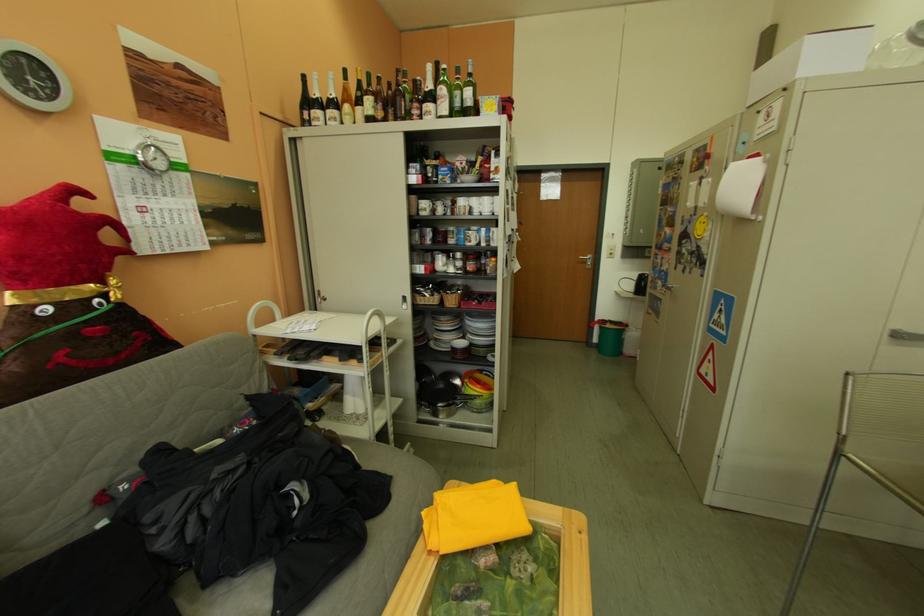
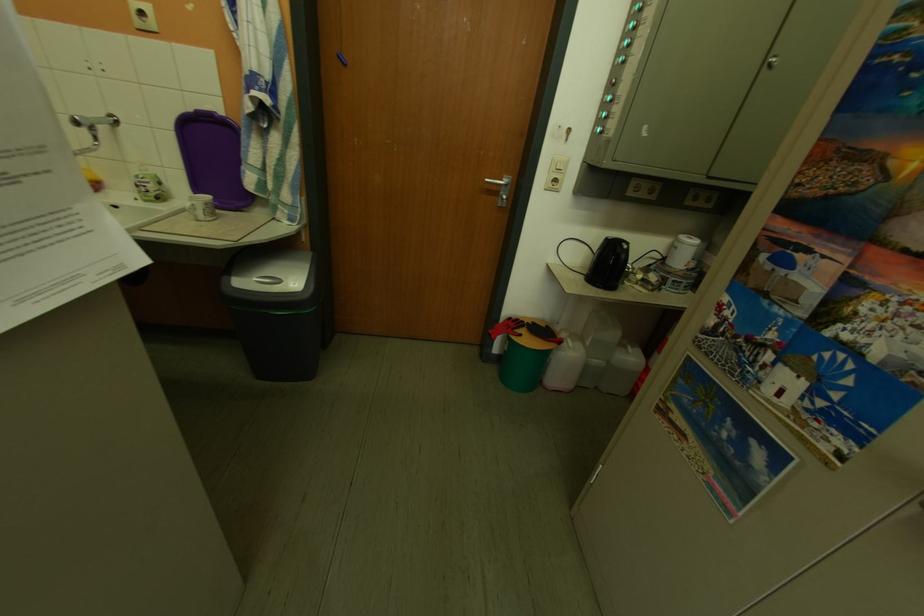
Locate, in the second image, the point that corresponds to (x=617, y=326) in the first image.

(533, 338)